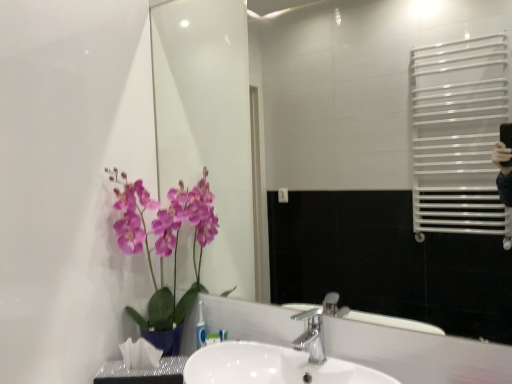
Question: Is purple silk orchid at left directly adjacent to white glossy sink at center?

Choices:
 (A) no
 (B) yes

Answer: (A)

Question: Is purple silk orchid at left closer to camera compared to white glossy sink at center?

Choices:
 (A) no
 (B) yes

Answer: (A)

Question: Would you say purple silk orchid at left contains white glossy sink at center?

Choices:
 (A) no
 (B) yes

Answer: (A)

Question: Is purple silk orchid at left looking in the opposite direction of white glossy sink at center?

Choices:
 (A) yes
 (B) no

Answer: (B)

Question: From a real-world perspective, is purple silk orchid at left on top of white glossy sink at center?

Choices:
 (A) yes
 (B) no

Answer: (A)

Question: From a real-world perspective, is purple silk orchid at left physically located above or below white glossy sink at center?

Choices:
 (A) above
 (B) below

Answer: (A)

Question: Is purple silk orchid at left bigger or smaller than white glossy sink at center?

Choices:
 (A) small
 (B) big

Answer: (A)

Question: In terms of height, does purple silk orchid at left look taller or shorter compared to white glossy sink at center?

Choices:
 (A) tall
 (B) short

Answer: (A)

Question: Relative to white glossy sink at center, is purple silk orchid at left in front or behind?

Choices:
 (A) behind
 (B) front

Answer: (A)

Question: Considering the positions of point (273, 72) and point (318, 307), is point (273, 72) closer or farther from the camera than point (318, 307)?

Choices:
 (A) farther
 (B) closer

Answer: (A)

Question: In terms of width, does transparent glass mirror at upper center look wider or thinner when compared to silver metallic faucet at center?

Choices:
 (A) wide
 (B) thin

Answer: (B)

Question: In the image, is transparent glass mirror at upper center positioned in front of or behind silver metallic faucet at center?

Choices:
 (A) behind
 (B) front

Answer: (B)

Question: Based on their sizes in the image, would you say transparent glass mirror at upper center is bigger or smaller than silver metallic faucet at center?

Choices:
 (A) big
 (B) small

Answer: (A)

Question: From a real-world perspective, relative to transparent glass mirror at upper center, is white glossy sink at center vertically above or below?

Choices:
 (A) above
 (B) below

Answer: (B)

Question: Which is correct: white glossy sink at center is inside transparent glass mirror at upper center, or outside of it?

Choices:
 (A) outside
 (B) inside

Answer: (A)